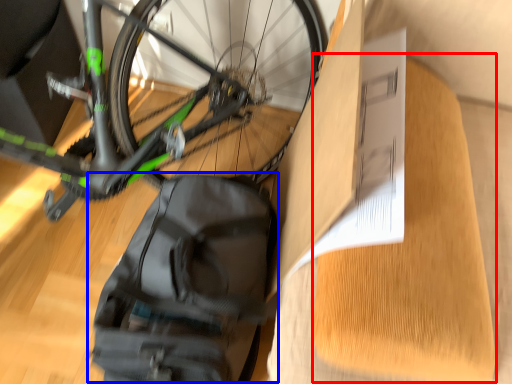
Question: Which object is further to the camera taking this photo, cardboard (highlighted by a red box) or backpack (highlighted by a blue box)?

Choices:
 (A) cardboard
 (B) backpack

Answer: (B)